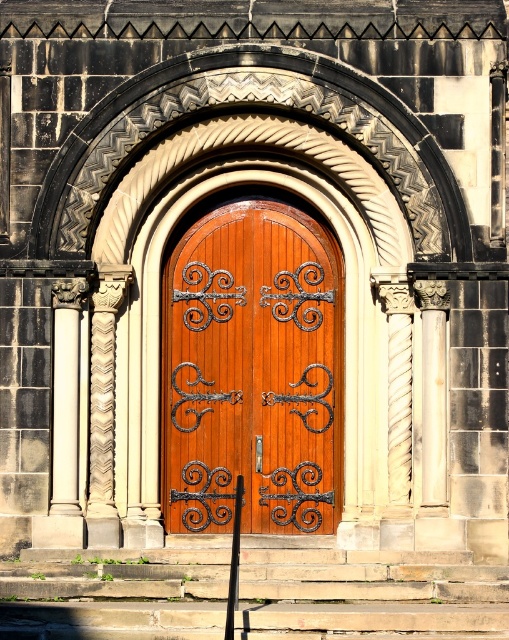
Does polished wood door at center have a larger size compared to carved stone column at left?

Indeed, polished wood door at center has a larger size compared to carved stone column at left.

What are the coordinates of `polished wood door at center` in the screenshot? It's located at (251, 371).

Identify the location of polished wood door at center. The height and width of the screenshot is (640, 509). (251, 371).